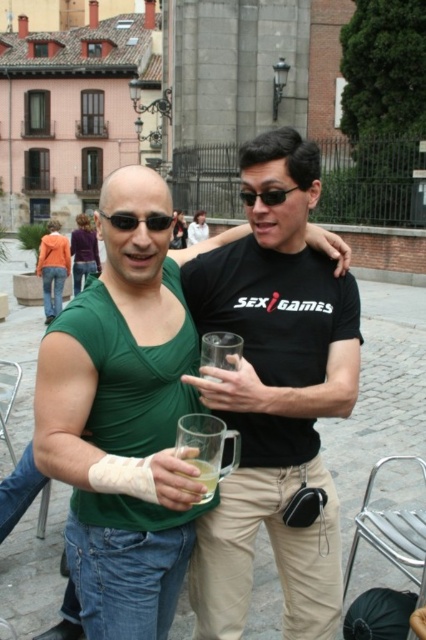
Does orange cotton jacket at upper left have a greater height compared to white fabric shirt at upper center?

Indeed, orange cotton jacket at upper left has a greater height compared to white fabric shirt at upper center.

Between orange cotton jacket at upper left and white fabric shirt at upper center, which one has less height?

white fabric shirt at upper center is shorter.

What do you see at coordinates (52, 268) in the screenshot? The height and width of the screenshot is (640, 426). I see `orange cotton jacket at upper left` at bounding box center [52, 268].

Identify the location of orange cotton jacket at upper left. (52, 268).

Can you confirm if translucent glass mug at center is positioned above matte black sunglasses at upper center?

Incorrect, translucent glass mug at center is not positioned above matte black sunglasses at upper center.

Is translucent glass mug at center smaller than matte black sunglasses at upper center?

Indeed, translucent glass mug at center has a smaller size compared to matte black sunglasses at upper center.

Locate an element on the screen. Image resolution: width=426 pixels, height=640 pixels. translucent glass mug at center is located at coordinates (206, 476).

Can you confirm if purple sweater at center is wider than black matte sunglasses at center?

Yes, purple sweater at center is wider than black matte sunglasses at center.

Does purple sweater at center appear under black matte sunglasses at center?

No, purple sweater at center is not below black matte sunglasses at center.

Between point (80, 260) and point (115, 225), which one is positioned in front?

Point (115, 225) is in front.

In order to click on purple sweater at center in this screenshot , I will do `click(83, 252)`.